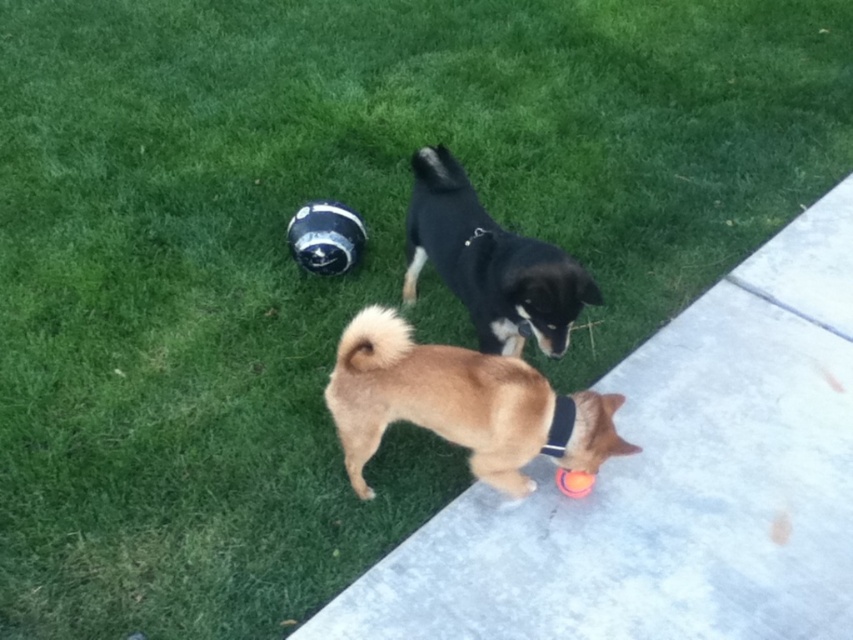
Question: Which of the following is the closest to the observer?

Choices:
 (A) (589, 474)
 (B) (566, 436)
 (C) (520, 314)
 (D) (723, 444)

Answer: (B)

Question: Among these points, which one is nearest to the camera?

Choices:
 (A) (418, 273)
 (B) (514, 612)

Answer: (B)

Question: Which point appears closest to the camera in this image?

Choices:
 (A) pyautogui.click(x=583, y=486)
 (B) pyautogui.click(x=842, y=253)
 (C) pyautogui.click(x=439, y=228)
 (D) pyautogui.click(x=436, y=401)

Answer: (D)

Question: Is concrete at lower right above orange rubber ball at lower right?

Choices:
 (A) yes
 (B) no

Answer: (A)

Question: Is concrete at lower right smaller than black fur dog at upper center?

Choices:
 (A) no
 (B) yes

Answer: (A)

Question: Is concrete at lower right thinner than black fur dog at upper center?

Choices:
 (A) yes
 (B) no

Answer: (B)